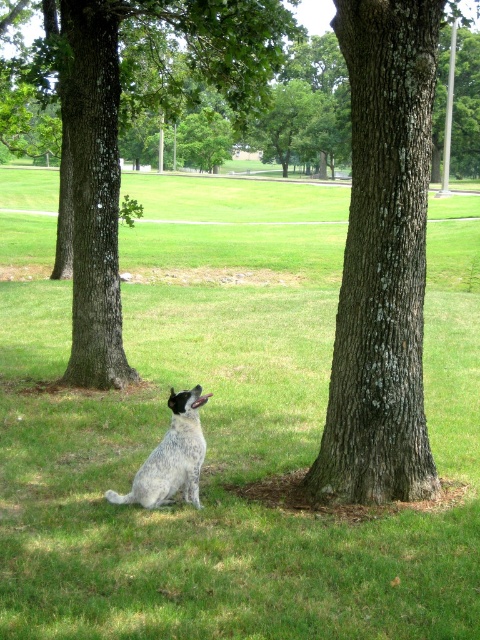
Question: Is green grass at center above smooth bark tree at center?

Choices:
 (A) yes
 (B) no

Answer: (A)

Question: Considering the real-world distances, which object is farthest from the spotted fur dog at center?

Choices:
 (A) brown rough tree at center
 (B) smooth bark tree at center

Answer: (A)

Question: Which object is farther from the camera taking this photo?

Choices:
 (A) brown rough tree at center
 (B) smooth bark tree at center
 (C) spotted fur dog at center

Answer: (A)

Question: Is green grass at center in front of smooth bark tree at center?

Choices:
 (A) yes
 (B) no

Answer: (A)

Question: Is green grass at center below spotted fur dog at center?

Choices:
 (A) yes
 (B) no

Answer: (B)

Question: Which point is farther to the camera?

Choices:
 (A) (160, 497)
 (B) (345, 246)
 (C) (113, 88)

Answer: (B)